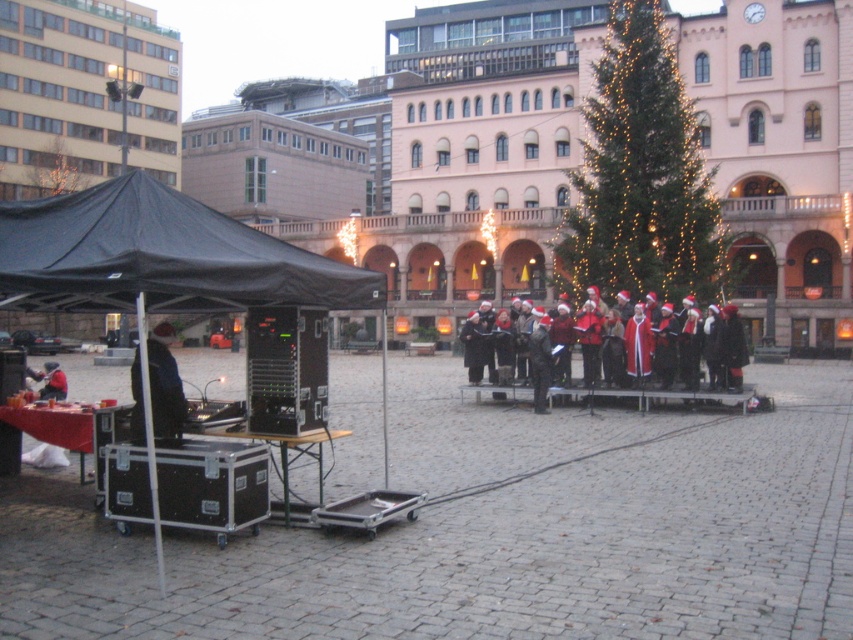
You are standing at the point labeled point (132, 240) in the scene. You want to walk to the point labeled point (340, 296). Which direction should you move?

To reach point (340, 296) from point (132, 240), you should move forward since point (340, 296) is behind point (132, 240).

You are a photographer standing at the center of the square. You want to capture a photo of the Christmas tree on the right side of the frame. However, there is a black fabric tent at left blocking your view. Can you move to the point indicated by the coordinates point [158,266] to get a clear shot of the Christmas tree?

The point [158,266] indicates the location of the black fabric tent at left. Moving to this point would place you directly at the tent, which is blocking the view of the Christmas tree. Therefore, moving to this point would not provide a clear shot of the Christmas tree.

You are a photographer trying to capture the Christmas tree on the right side of the square. You are currently standing at the center of the square. To avoid including the black fabric tent at left in your photo, should you move to your left or right?

You should move to your right to avoid the black fabric tent at left, as it is located to the left of your current position at the center of the square.